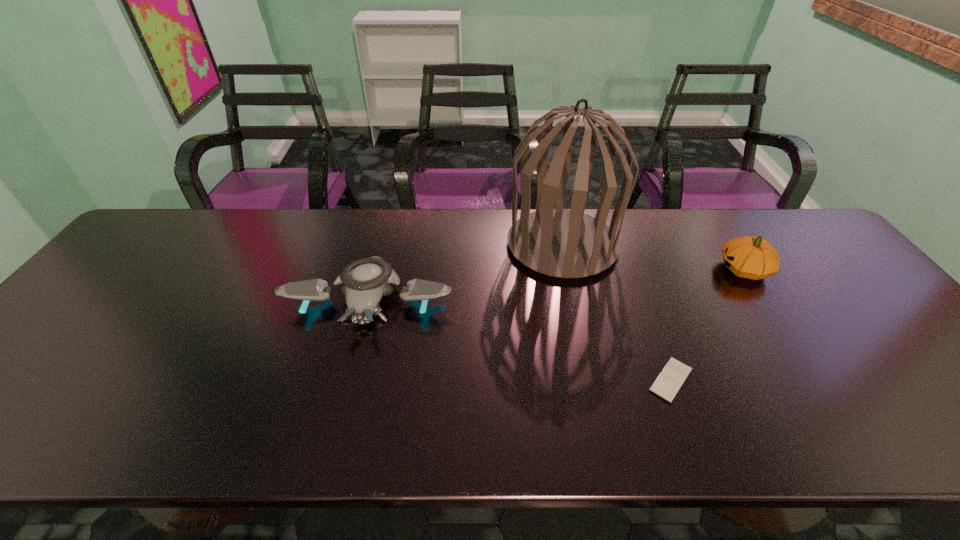
Where is `the tallest object`? This screenshot has height=540, width=960. the tallest object is located at coordinates (561, 243).

At what (x,y) coordinates should I click in order to perform the action: click on the third shortest object. Please return your answer as a coordinate pair (x, y). The width and height of the screenshot is (960, 540). Looking at the image, I should click on (750, 257).

Where is `the rightmost object`? The width and height of the screenshot is (960, 540). the rightmost object is located at coordinates (750, 257).

This screenshot has width=960, height=540. In order to click on the second shortest object in this screenshot , I will do `click(366, 280)`.

Where is `the leftmost object`? the leftmost object is located at coordinates (366, 280).

This screenshot has height=540, width=960. In order to click on the shortest object in this screenshot , I will do `click(670, 380)`.

At what (x,y) coordinates should I click in order to perform the action: click on the nearest object. Please return your answer as a coordinate pair (x, y). The image size is (960, 540). Looking at the image, I should click on (670, 380).

I want to click on vacant space situated on the right of the tallest object, so click(x=709, y=245).

Locate an element on the screen. Image resolution: width=960 pixels, height=540 pixels. vacant space situated 0.340m on the side of the rightmost object with the carved face is located at coordinates (599, 269).

Identify the location of free space located 0.170m on the side of the rightmost object with the carved face. (659, 269).